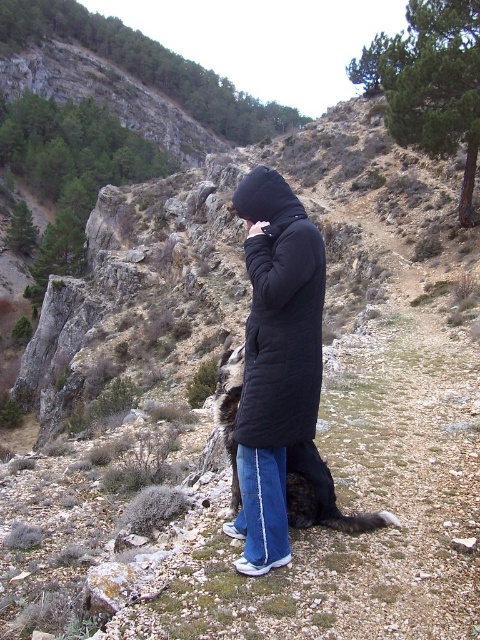
Who is lower down, black puffy coat at center or dark brown fur at center?

Positioned lower is dark brown fur at center.

Can you confirm if black puffy coat at center is positioned below dark brown fur at center?

No.

Which is in front, point (298, 392) or point (314, 522)?

Point (298, 392) is in front.

Locate an element on the screen. This screenshot has height=640, width=480. black puffy coat at center is located at coordinates (279, 314).